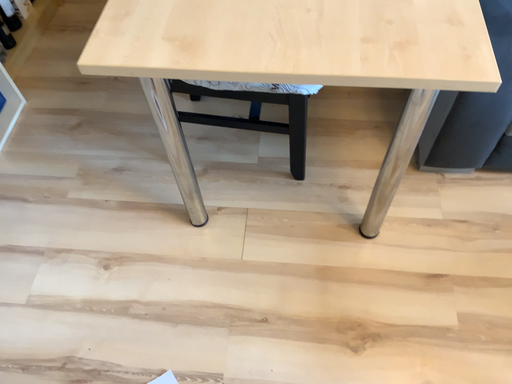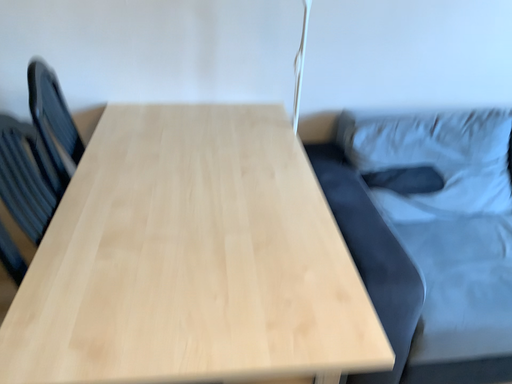
Question: How did the camera likely rotate when shooting the video?

Choices:
 (A) rotated downward
 (B) rotated upward

Answer: (B)